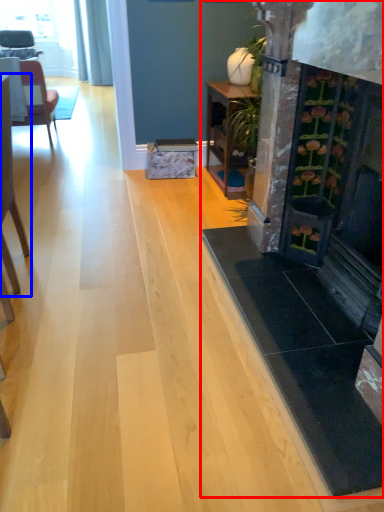
Question: Which point is closer to the camera, fireplace (highlighted by a red box) or chair (highlighted by a blue box)?

Choices:
 (A) fireplace
 (B) chair

Answer: (A)